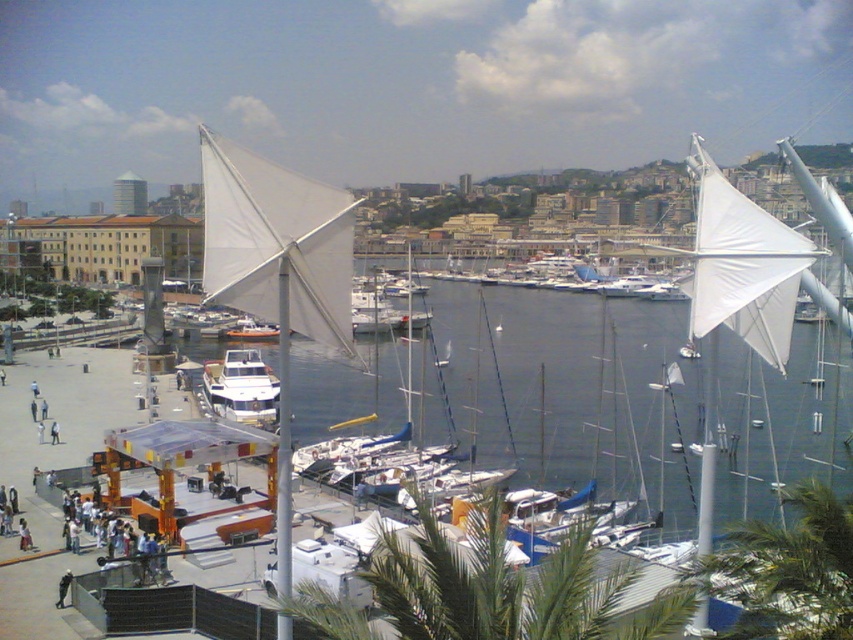
You are standing at the waterfront and want to reach a specific point marked as point [746,320]. If you walk straight ahead from your current position, will you reach that point before walking 60 meters?

The distance between point [746,320] and the viewer is 58.35 meters, so yes, you will reach the point before walking 60 meters.

Looking at this image, you are a photographer planning to capture a photo of the white fabric sail at center and the green leafy palm tree at lower right. Which object should you focus on first if you want to include both in your shot without moving the camera?

The white fabric sail at center should be focused on first because it is much taller than the green leafy palm tree at lower right, so it will occupy more space in the frame.

You are a photographer wanting to capture both the white fabric sail at upper right and the white glossy sailboat at center in a single shot. Based on their positions, can you fit both in the frame without moving the camera? Explain why or why not.

The white fabric sail at upper right is above the white glossy sailboat at center, so yes, both can be captured in a single frame without moving the camera as they are vertically aligned.